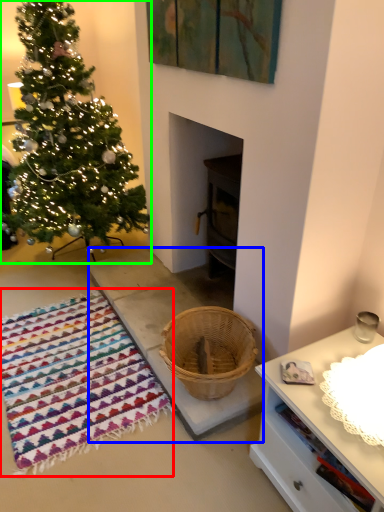
Question: Which object is the closest to the blanket (highlighted by a red box)? Choose among these: concrete (highlighted by a blue box) or christmas tree (highlighted by a green box).

Choices:
 (A) concrete
 (B) christmas tree

Answer: (A)